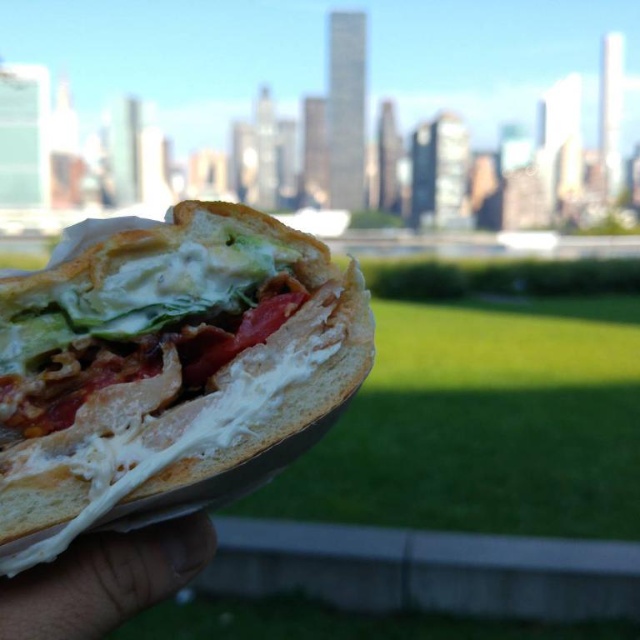
Does white soft bread at center have a lesser height compared to skinny white hand at lower left?

No.

Does point (61, 406) come behind point (113, 554)?

Yes, it is behind point (113, 554).

Where is `white soft bread at center`? The image size is (640, 640). white soft bread at center is located at coordinates (164, 364).